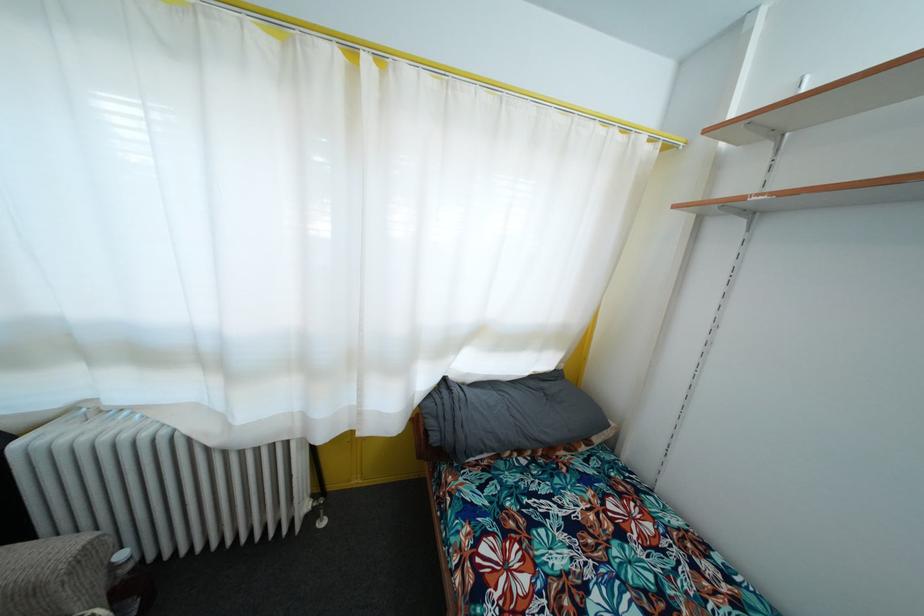
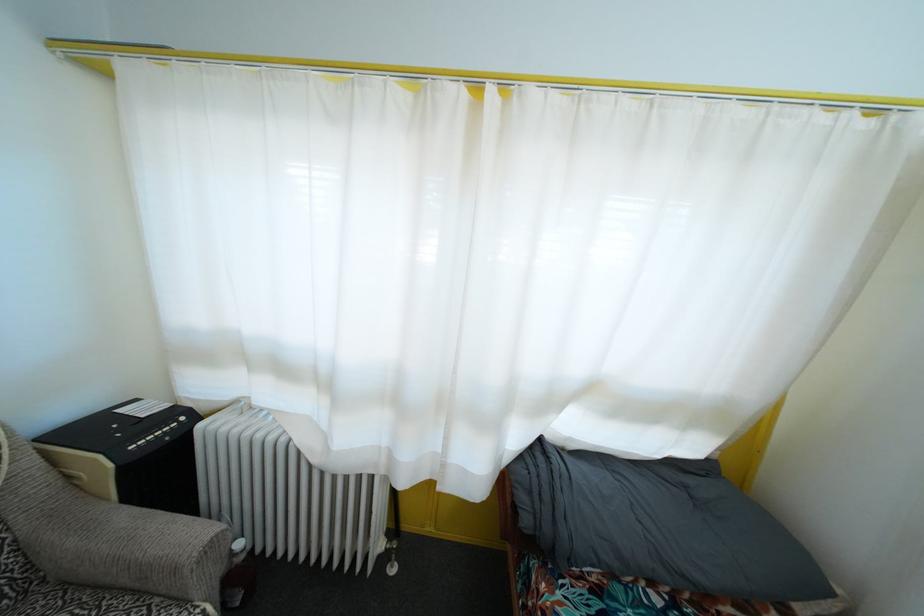
Find the pixel in the second image that matches the point at 365,336 in the first image.

(457, 379)